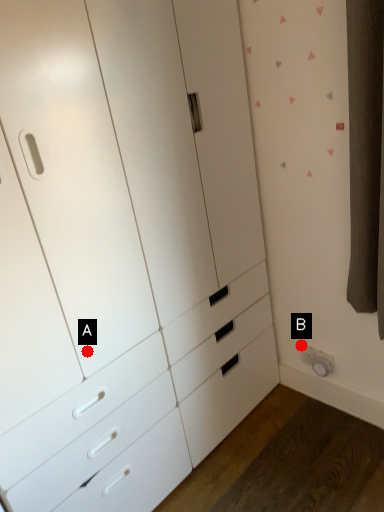
Question: Two points are circled on the image, labeled by A and B beside each circle. Which point is closer to the camera taking this photo?

Choices:
 (A) A is closer
 (B) B is closer

Answer: (A)